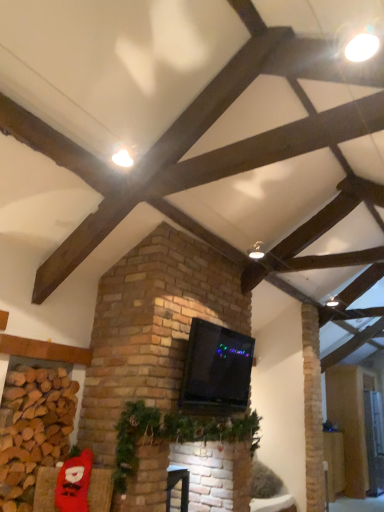
Question: Considering the relative sizes of wooden floorboard at lower right and red plush santa at lower left in the image provided, is wooden floorboard at lower right smaller than red plush santa at lower left?

Choices:
 (A) no
 (B) yes

Answer: (A)

Question: From the image's perspective, is wooden floorboard at lower right beneath red plush santa at lower left?

Choices:
 (A) no
 (B) yes

Answer: (B)

Question: Can you confirm if wooden floorboard at lower right is positioned to the left of red plush santa at lower left?

Choices:
 (A) no
 (B) yes

Answer: (A)

Question: Is red plush santa at lower left at the back of wooden floorboard at lower right?

Choices:
 (A) yes
 (B) no

Answer: (B)

Question: Considering the relative positions of wooden floorboard at lower right and red plush santa at lower left in the image provided, is wooden floorboard at lower right behind red plush santa at lower left?

Choices:
 (A) yes
 (B) no

Answer: (A)

Question: Is wooden floorboard at lower right thinner than red plush santa at lower left?

Choices:
 (A) no
 (B) yes

Answer: (A)

Question: Does green garland at center have a larger size compared to wooden floorboard at lower right?

Choices:
 (A) no
 (B) yes

Answer: (B)

Question: Is green garland at center far from wooden floorboard at lower right?

Choices:
 (A) yes
 (B) no

Answer: (A)

Question: Is green garland at center closer to camera compared to wooden floorboard at lower right?

Choices:
 (A) yes
 (B) no

Answer: (A)

Question: From a real-world perspective, is green garland at center on top of wooden floorboard at lower right?

Choices:
 (A) no
 (B) yes

Answer: (B)

Question: Is green garland at center directly adjacent to wooden floorboard at lower right?

Choices:
 (A) yes
 (B) no

Answer: (B)

Question: Would you say green garland at center is outside wooden floorboard at lower right?

Choices:
 (A) no
 (B) yes

Answer: (B)

Question: From a real-world perspective, is black glossy tv at center located higher than brown brick at lower left?

Choices:
 (A) yes
 (B) no

Answer: (A)